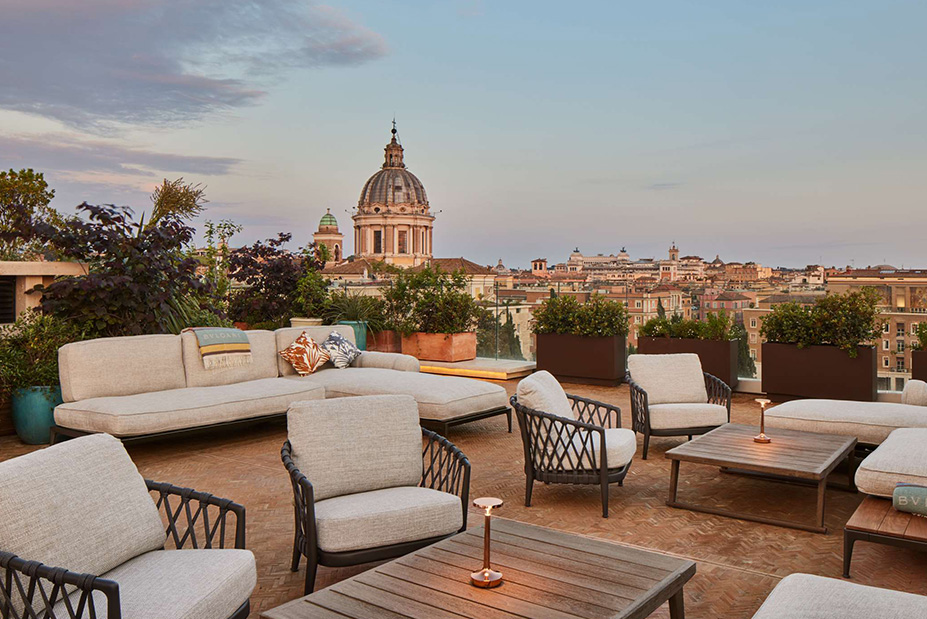
This screenshot has width=927, height=619. What are the coordinates of `orange pillow` in the screenshot? It's located at (311, 361).